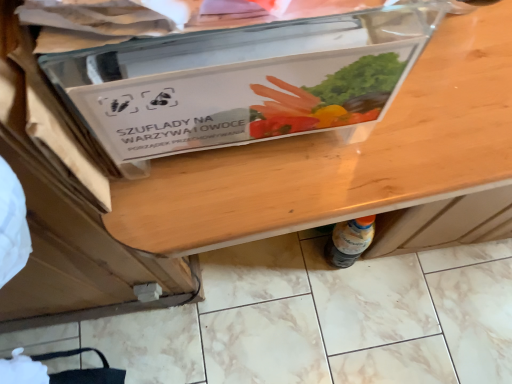
Where is `vacant space to the right of transparent plastic lunch box at center`? The height and width of the screenshot is (384, 512). vacant space to the right of transparent plastic lunch box at center is located at coordinates (445, 107).